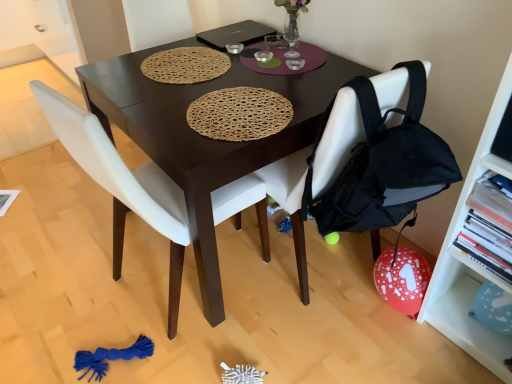
The image size is (512, 384). Identify the location of vacant point above black matte laptop at upper center (from a real-world perspective). (240, 27).